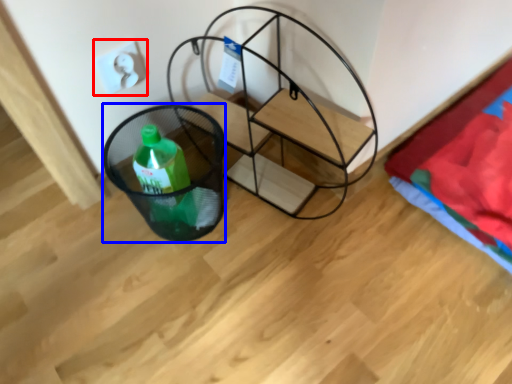
Question: Which object is closer to the camera taking this photo, electric outlet (highlighted by a red box) or basket (highlighted by a blue box)?

Choices:
 (A) electric outlet
 (B) basket

Answer: (B)